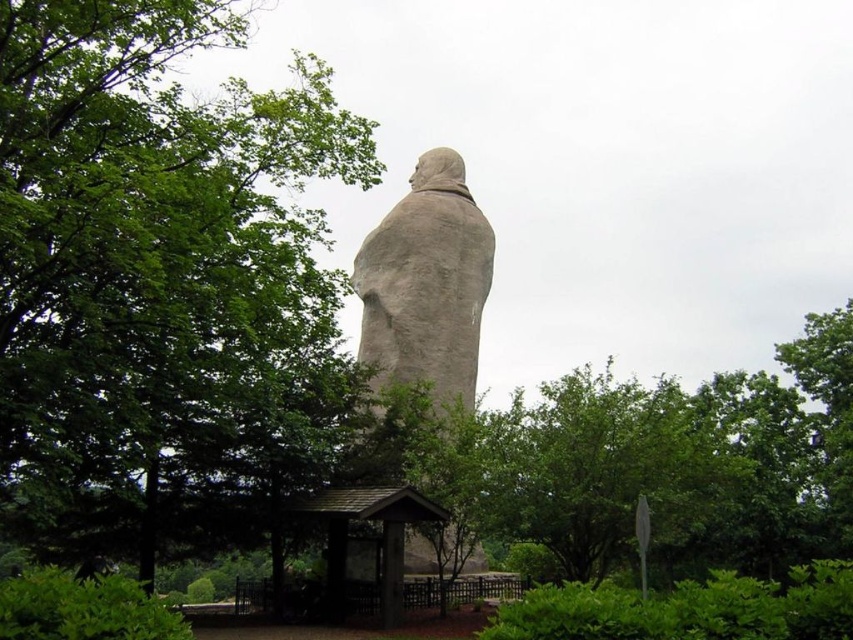
Question: Is green leafy tree at left below brown wooden shelter at lower center?

Choices:
 (A) yes
 (B) no

Answer: (B)

Question: Which point is farther from the camera taking this photo?

Choices:
 (A) (401, 492)
 (B) (430, 196)

Answer: (B)

Question: Which object is the closest to the brown wooden shelter at lower center?

Choices:
 (A) gray stone statue at center
 (B) green leafy tree at left

Answer: (A)

Question: Can you confirm if green leafy tree at left is positioned below gray stone statue at center?

Choices:
 (A) yes
 (B) no

Answer: (B)

Question: Is gray stone statue at center wider than brown wooden shelter at lower center?

Choices:
 (A) no
 (B) yes

Answer: (B)

Question: Estimate the real-world distances between objects in this image. Which object is closer to the gray stone statue at center?

Choices:
 (A) brown wooden shelter at lower center
 (B) green leafy tree at left

Answer: (A)